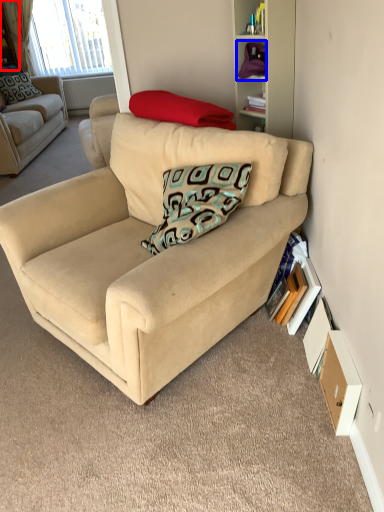
Question: Among these objects, which one is farthest to the camera, shelf (highlighted by a red box) or shelf (highlighted by a blue box)?

Choices:
 (A) shelf
 (B) shelf

Answer: (A)